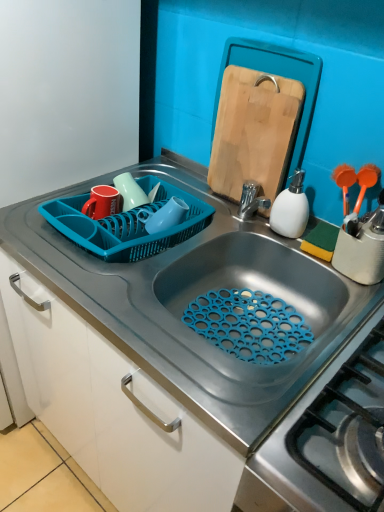
Locate an element on the screen. free space behind matte ceramic mugs at upper center, which appears as the first tableware when viewed from the right is located at coordinates (156, 183).